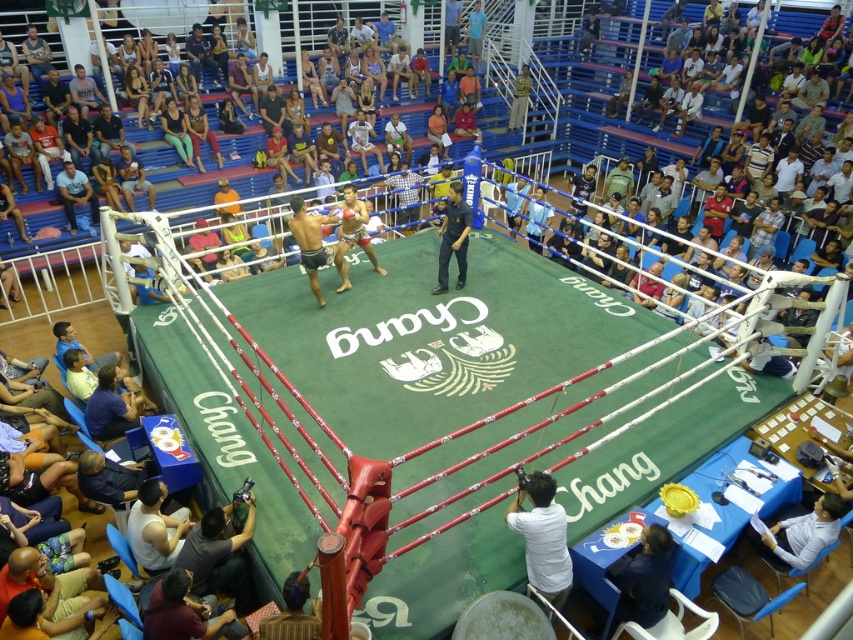
You are a photographer trying to capture the boxing match. You notice two items in the foreground that might distract from the fighters. The dark gray fabric at lower left and the matte blue shirt at left. Which item should you avoid focusing on to minimize distraction, considering their sizes?

The dark gray fabric at lower left occupies less space than the matte blue shirt at left, so focusing on the matte blue shirt at left would be more distracting due to its larger size.

You are a photographer standing at the edge of the boxing ring. You need to take a photo of the dark blue jeans at center and the matte blue shirt at left. The minimum distance your camera can focus clearly is 20 feet. Will both subjects be in focus at the same time?

The dark blue jeans at center is 21.33 feet away from the matte blue shirt at left. Since the minimum focus distance is 20 feet, both subjects are beyond this distance, so they should be in focus simultaneously.